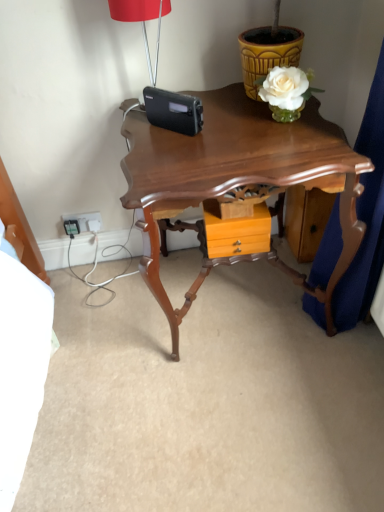
Question: Does yellow textured flowerpot at upper right have a greater height compared to matte red lampshade at upper center?

Choices:
 (A) no
 (B) yes

Answer: (A)

Question: Can you confirm if yellow textured flowerpot at upper right is positioned to the right of matte red lampshade at upper center?

Choices:
 (A) no
 (B) yes

Answer: (B)

Question: Would you say yellow textured flowerpot at upper right is outside matte red lampshade at upper center?

Choices:
 (A) yes
 (B) no

Answer: (A)

Question: Is yellow textured flowerpot at upper right to the left of matte red lampshade at upper center from the viewer's perspective?

Choices:
 (A) yes
 (B) no

Answer: (B)

Question: Does yellow textured flowerpot at upper right have a greater width compared to matte red lampshade at upper center?

Choices:
 (A) yes
 (B) no

Answer: (A)

Question: From the image's perspective, would you say yellow textured flowerpot at upper right is shown under matte red lampshade at upper center?

Choices:
 (A) yes
 (B) no

Answer: (B)

Question: Is the surface of white plastic electrical outlet at lower left in direct contact with shiny brown wooden table at center?

Choices:
 (A) yes
 (B) no

Answer: (B)

Question: From a real-world perspective, does white plastic electrical outlet at lower left sit lower than shiny brown wooden table at center?

Choices:
 (A) no
 (B) yes

Answer: (B)

Question: Is white plastic electrical outlet at lower left outside shiny brown wooden table at center?

Choices:
 (A) no
 (B) yes

Answer: (B)

Question: Considering the relative sizes of white plastic electrical outlet at lower left and shiny brown wooden table at center in the image provided, is white plastic electrical outlet at lower left wider than shiny brown wooden table at center?

Choices:
 (A) no
 (B) yes

Answer: (A)

Question: Is white plastic electrical outlet at lower left far from shiny brown wooden table at center?

Choices:
 (A) no
 (B) yes

Answer: (A)

Question: Could you tell me if white plastic electrical outlet at lower left is facing shiny brown wooden table at center?

Choices:
 (A) no
 (B) yes

Answer: (A)

Question: Does white plastic electrical outlet at lower left appear on the right side of orange wood drawer at center?

Choices:
 (A) yes
 (B) no

Answer: (B)